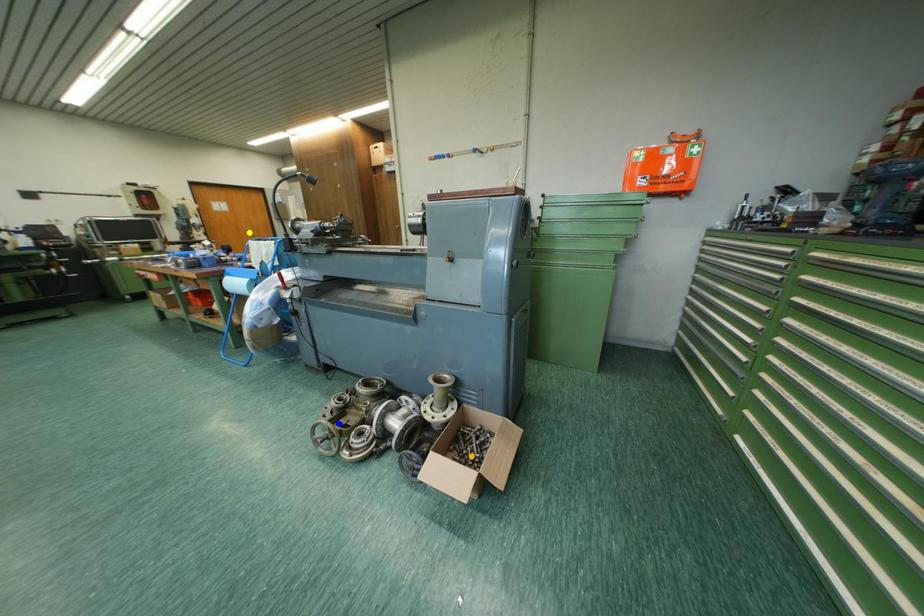
Order these from nearest to farthest:
A) orange point
B) yellow point
C) blue point

orange point < blue point < yellow point